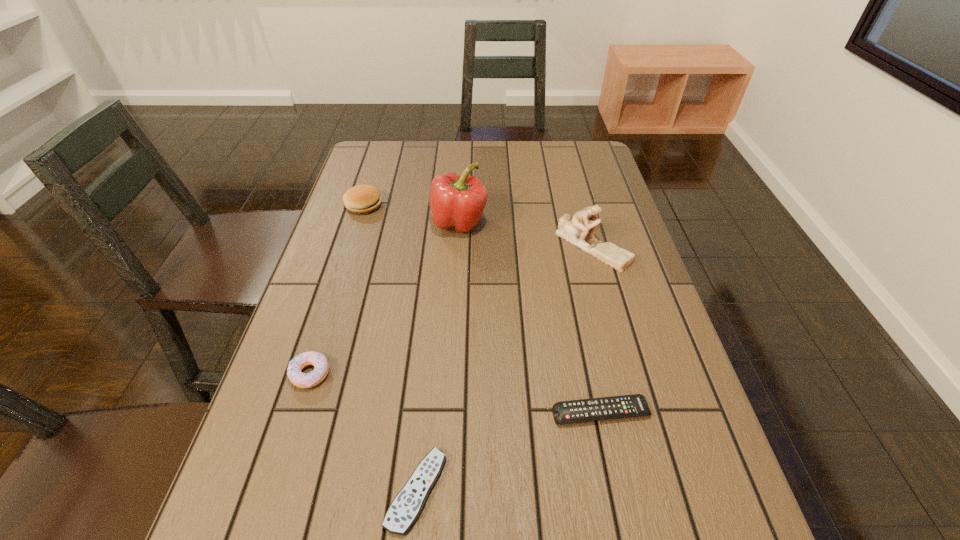
Identify the location of unoccupied position between the right remote control and the figurine. (597, 329).

Locate an element on the screen. The height and width of the screenshot is (540, 960). empty space that is in between the farther remote control and the fifth shortest object is located at coordinates (597, 329).

This screenshot has height=540, width=960. I want to click on object that is the fifth closest one to the tallest object, so click(406, 507).

Identify which object is the fifth nearest to the second tallest object. Please provide its 2D coordinates. Your answer should be formatted as a tuple, i.e. [(x, y)], where the tuple contains the x and y coordinates of a point satisfying the conditions above.

[(302, 380)]

This screenshot has height=540, width=960. I want to click on remote control that is the second closest to the tallest object, so click(406, 507).

Find the location of a particular element. vacant point that satisfies the following two spatial constraints: 1. on the back side of the patty; 2. on the right side of the fourth tallest object is located at coordinates (363, 206).